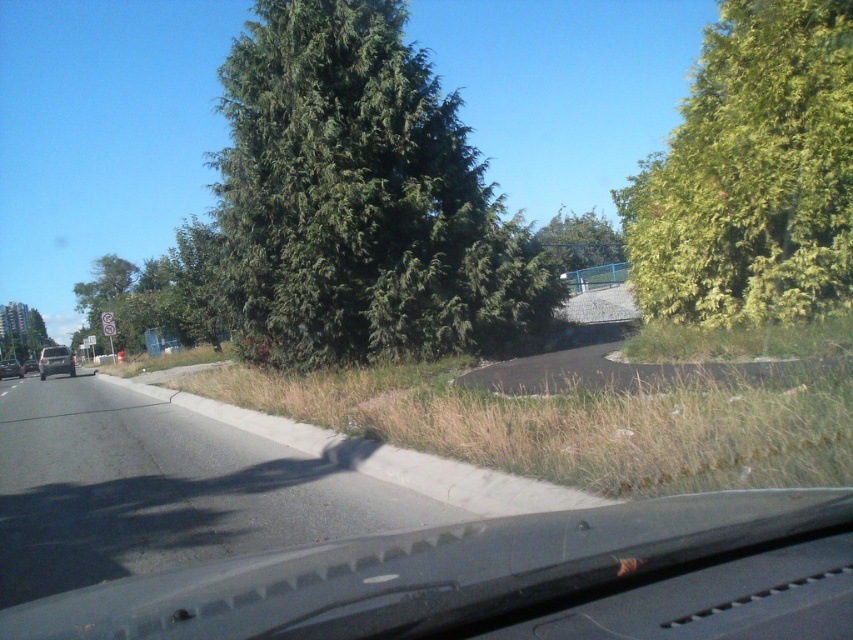
Question: Considering the relative positions of green leafy tree at center and green leafy tree at upper center in the image provided, where is green leafy tree at center located with respect to green leafy tree at upper center?

Choices:
 (A) below
 (B) above

Answer: (B)

Question: Does black rubber windshield at lower center have a greater width compared to green leafy tree at upper center?

Choices:
 (A) no
 (B) yes

Answer: (A)

Question: Which of the following is the closest to the observer?

Choices:
 (A) green leafy tree at center
 (B) green leafy tree at left
 (C) black rubber windshield at lower center
 (D) asphalt road at lower left

Answer: (C)

Question: Is green leafy tree at upper right in front of silver metallic sedan at left?

Choices:
 (A) no
 (B) yes

Answer: (B)

Question: Which object appears farthest from the camera in this image?

Choices:
 (A) silver metallic sedan at left
 (B) green leafy tree at left
 (C) black rubber windshield at lower center
 (D) matte silver sedan at left

Answer: (D)

Question: Among these points, which one is nearest to the camera?

Choices:
 (A) (532, 532)
 (B) (611, 259)

Answer: (A)